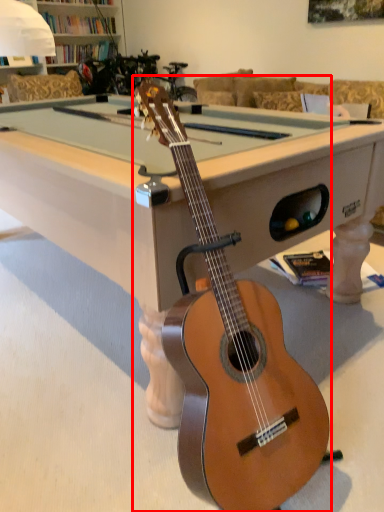
Question: In this image, where is guitar (annotated by the red box) located relative to billiard table?

Choices:
 (A) left
 (B) right

Answer: (B)